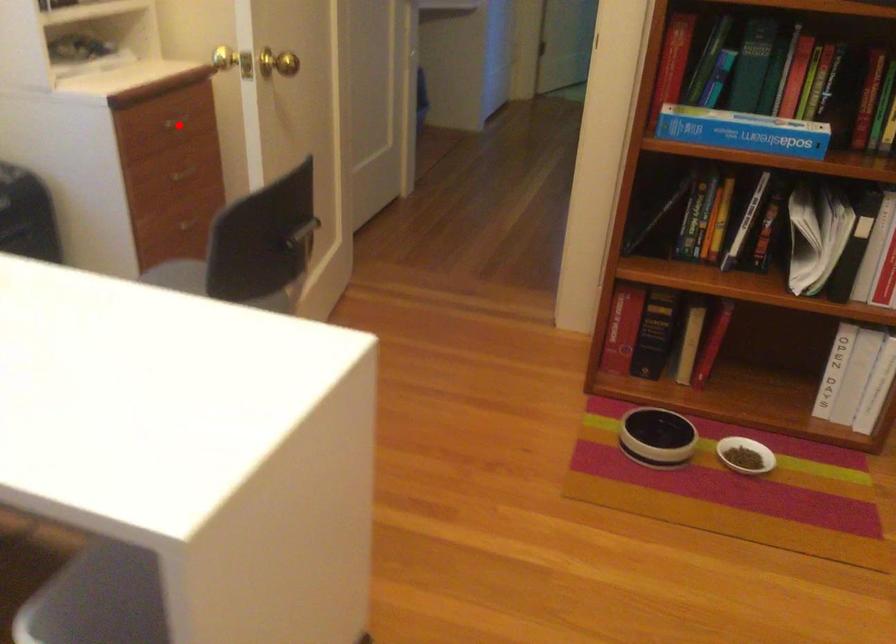
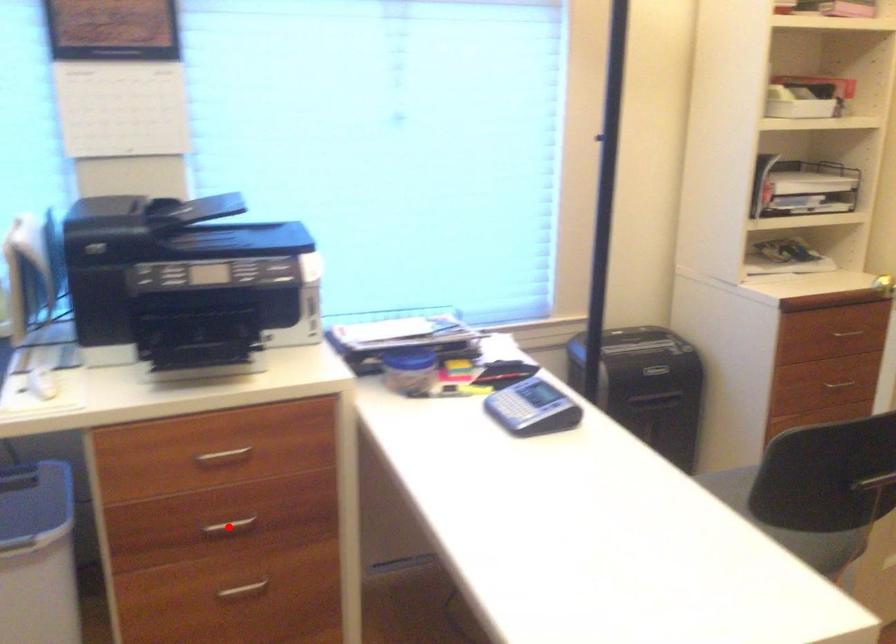
I am providing you with two images of the same scene from different viewpoints. A red point is marked on the first image and another point is marked on the second image. Does the point marked in image1 correspond to the same location as the one in image2?

No